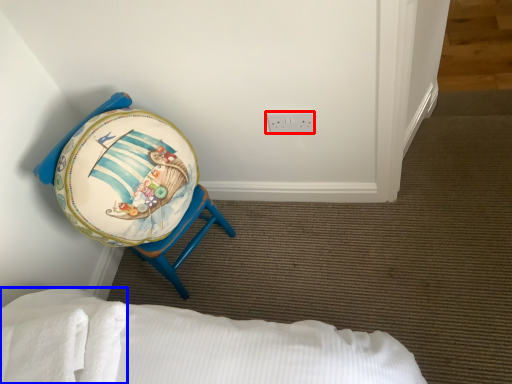
Question: Among these objects, which one is farthest to the camera, electric outlet (highlighted by a red box) or sheet (highlighted by a blue box)?

Choices:
 (A) electric outlet
 (B) sheet

Answer: (A)